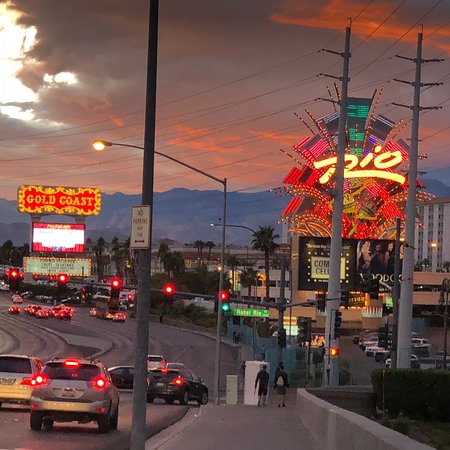
The height and width of the screenshot is (450, 450). What are the coordinates of `wall` in the screenshot? It's located at (343, 432).